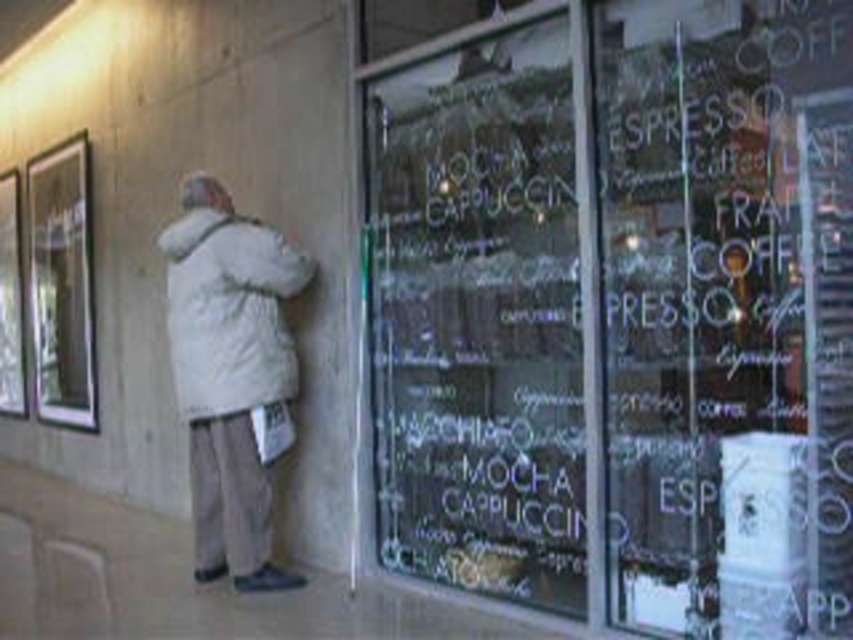
You are a customer at the coffee shop and want to read the menu displayed on the white chalkboard at center. You are wearing a white matte coat at center. Since both items are at the center, which one is closer to you?

The white chalkboard at center is larger in size than the white matte coat at center, so the white matte coat at center is closer to you since larger objects can appear closer when they are the same distance, but since they are at the same center position, the larger one might be further back to maintain the center, making the smaller coat closer.

You are a delivery person standing at the entrance of the coffee shop. You need to hand over a package to the person wearing the white matte coat at center. Based on the scene description, where should you look to find the person?

The person wearing the white matte coat at center is located at the coordinates point [231,376], so you should look towards that point to find them.